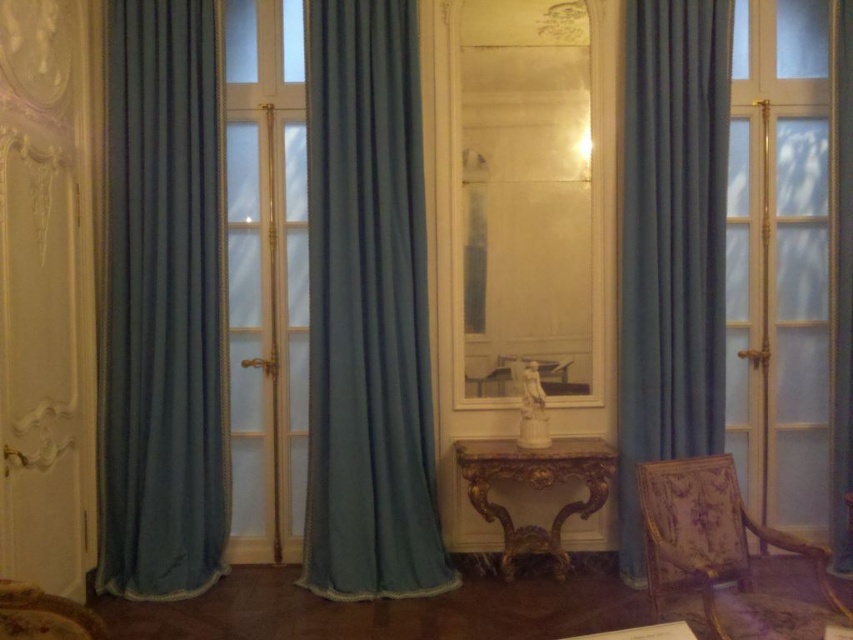
Question: Which object is the farthest from the matte glass door at right?

Choices:
 (A) teal velvet curtain at right
 (B) teal velvet curtain at center

Answer: (B)

Question: Is teal fabric curtain at left wider than gold ornate table at center?

Choices:
 (A) no
 (B) yes

Answer: (A)

Question: Can you confirm if teal fabric curtain at left is smaller than teal velvet curtain at right?

Choices:
 (A) yes
 (B) no

Answer: (B)

Question: Which object is closer to the camera taking this photo?

Choices:
 (A) clear glass mirror at center
 (B) gold ornate table at center
 (C) teal velvet curtain at right

Answer: (B)

Question: Can you confirm if teal velvet curtain at right is thinner than gold ornate table at center?

Choices:
 (A) no
 (B) yes

Answer: (B)

Question: Which of the following is the farthest from the observer?

Choices:
 (A) matte glass door at right
 (B) teal velvet curtain at center

Answer: (A)